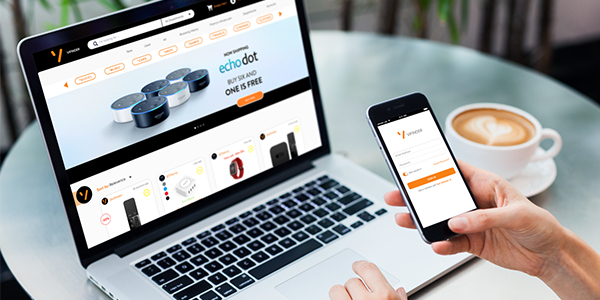
Where is `round desk`? This screenshot has width=600, height=300. round desk is located at coordinates (423, 74).